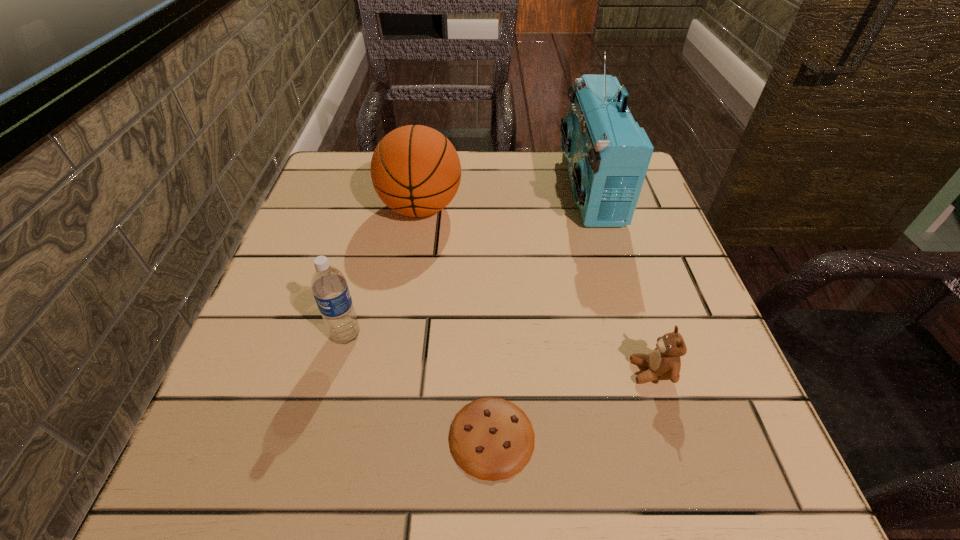
What are the coordinates of `vacant space located on the front of the basketball` in the screenshot? It's located at (414, 255).

Locate an element on the screen. This screenshot has height=540, width=960. free space located on the front of the water bottle is located at coordinates (320, 437).

Find the location of a particular element. vacant space located on the front-facing side of the second nearest object is located at coordinates (580, 372).

I want to click on free space located 0.220m on the front-facing side of the second nearest object, so click(x=490, y=372).

Locate an element on the screen. The width and height of the screenshot is (960, 540). vacant space located on the front-facing side of the second nearest object is located at coordinates (387, 372).

Identify the location of free space located on the back of the shortest object. This screenshot has height=540, width=960. (489, 269).

Where is `radio receiver that is at the far edge`? radio receiver that is at the far edge is located at coordinates (608, 154).

The width and height of the screenshot is (960, 540). Find the location of `basketball that is at the far edge`. basketball that is at the far edge is located at coordinates click(x=415, y=170).

I want to click on object that is at the near edge, so click(492, 439).

Locate an element on the screen. This screenshot has height=540, width=960. basketball present at the left edge is located at coordinates (415, 170).